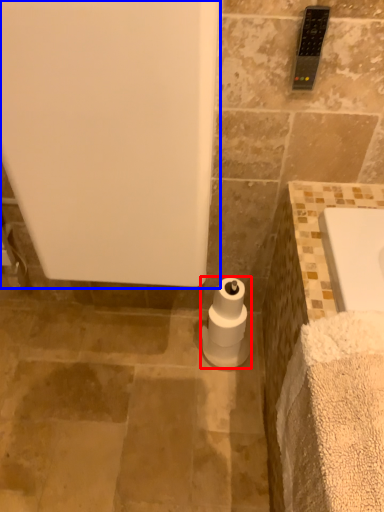
Question: Among these objects, which one is farthest to the camera, toilet paper (highlighted by a red box) or bath (highlighted by a blue box)?

Choices:
 (A) toilet paper
 (B) bath

Answer: (A)